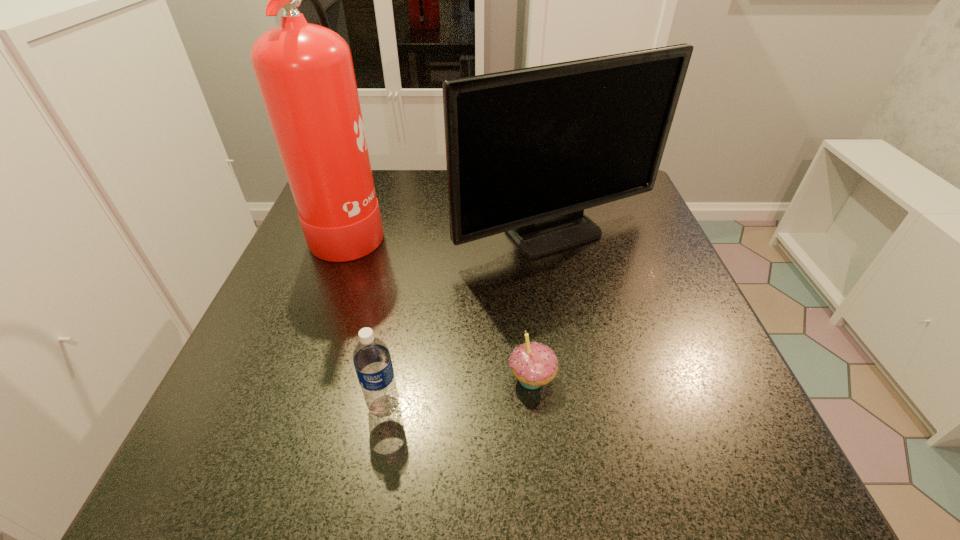
The height and width of the screenshot is (540, 960). Identify the location of free spot at the far right corner of the desktop. (638, 211).

At what (x,y) coordinates should I click in order to perform the action: click on vacant region at the near right corner of the desktop. Please return your answer as a coordinate pair (x, y). Looking at the image, I should click on (712, 466).

At what (x,y) coordinates should I click in order to perform the action: click on vacant space that's between the third object from right to left and the cupcake. Please return your answer as a coordinate pair (x, y). Image resolution: width=960 pixels, height=540 pixels. Looking at the image, I should click on (458, 393).

At what (x,y) coordinates should I click in order to perform the action: click on free area in between the computer monitor and the shortest object. Please return your answer as a coordinate pair (x, y). Image resolution: width=960 pixels, height=540 pixels. Looking at the image, I should click on (543, 307).

Where is `free space between the computer monitor and the second shortest object`? The width and height of the screenshot is (960, 540). free space between the computer monitor and the second shortest object is located at coordinates (470, 321).

The width and height of the screenshot is (960, 540). I want to click on empty space that is in between the shortest object and the leftmost object, so click(x=442, y=303).

You are a GUI agent. You are given a task and a screenshot of the screen. Output one action in this format:
    pyautogui.click(x=<x>, y=<y>)
    Task: Click on the vacant space in between the second tallest object and the shortest object
    This screenshot has height=540, width=960.
    Given the screenshot: What is the action you would take?
    pyautogui.click(x=543, y=307)

The height and width of the screenshot is (540, 960). What are the coordinates of `vacant point located between the fire extinguisher and the second shortest object` in the screenshot? It's located at (368, 316).

Image resolution: width=960 pixels, height=540 pixels. Find the location of `free space that is in between the cupcake and the third shortest object`. free space that is in between the cupcake and the third shortest object is located at coordinates (543, 307).

Locate an element on the screen. vacant area that lies between the cupcake and the fire extinguisher is located at coordinates (442, 303).